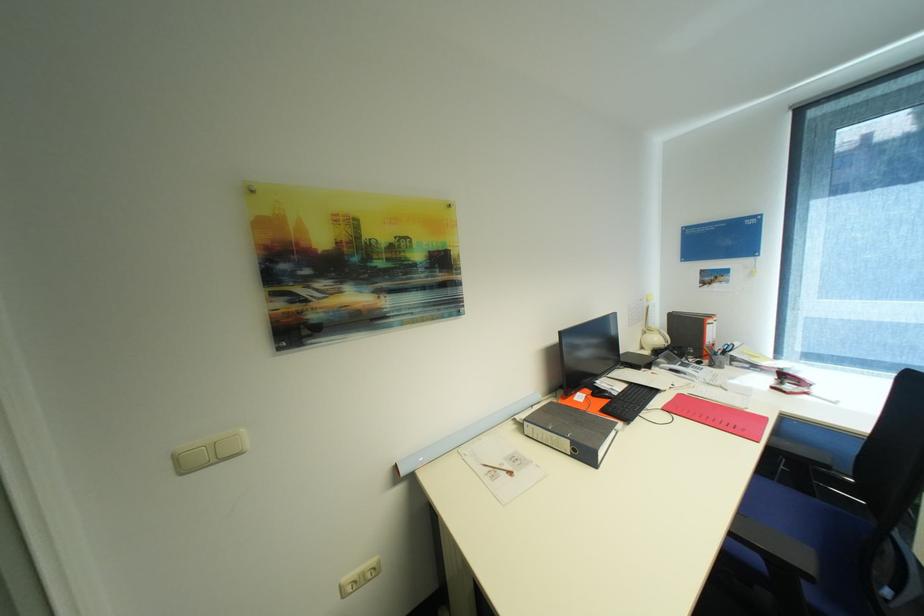
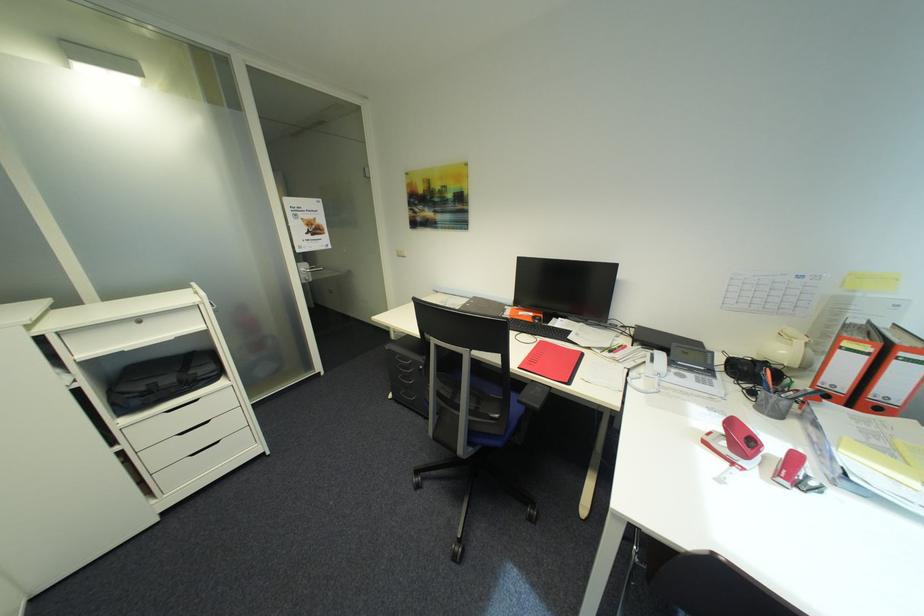
Where in the second image is the point corresponding to pixel 813 394 from the first image?

(742, 464)